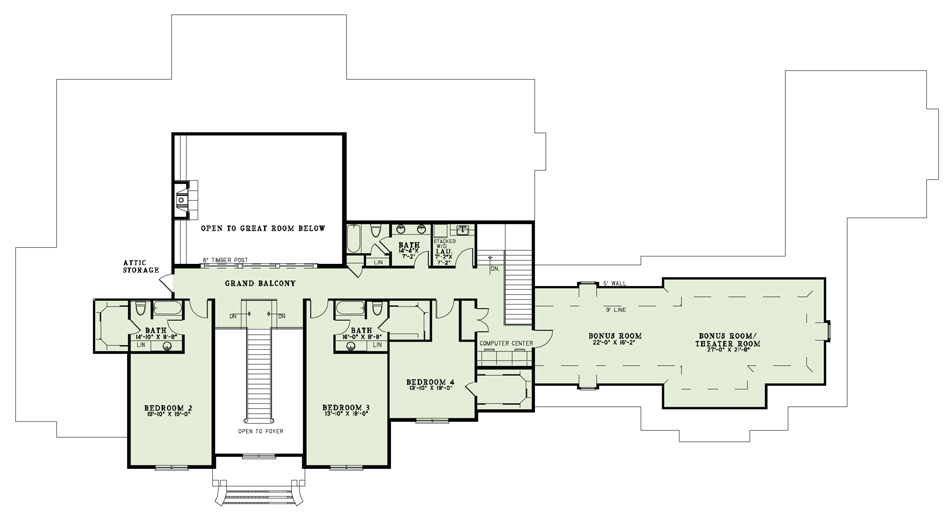
This screenshot has height=517, width=950. I want to click on room to watch movies in, so click(684, 337).